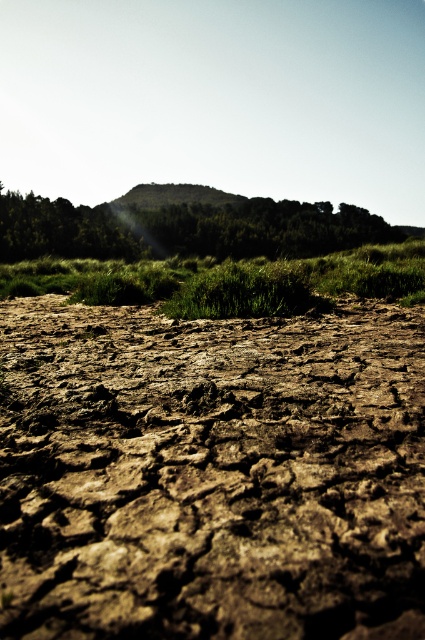
Who is taller, green grass at center or green matte grass at center?

green grass at center

Which is above, green grass at center or green matte grass at center?

green grass at center is higher up.

This screenshot has width=425, height=640. I want to click on green grass at center, so click(x=226, y=280).

Does green grassy hill at upper center have a larger size compared to green grass at center?

Yes, green grassy hill at upper center is bigger than green grass at center.

Find the location of `green grassy hill at upper center`. green grassy hill at upper center is located at coordinates (183, 228).

Between point (345, 490) and point (405, 285), which one is positioned behind?

The point (405, 285) is behind.

Between brown cracked soil at center and green grass at center, which one has less height?

brown cracked soil at center

Find the location of `brown cracked soil at center`. brown cracked soil at center is located at coordinates (210, 474).